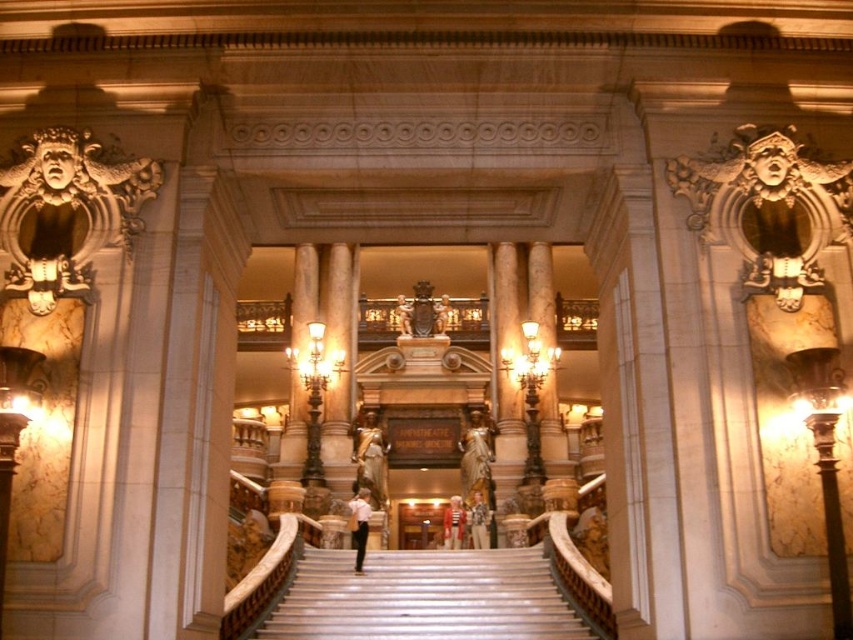
You are standing at the bottom of the staircase in the grand building. You see a light brown leather jacket at center. Can you estimate its location relative to the staircase?

The light brown leather jacket at center is located at point 0.816 along the x axis and 0.562 along the y axis, which is approximately 81.6 percent from the left edge and 56.2 percent from the bottom edge of the image.

You are standing at the bottom of the staircase and see the matte gold statue at center and the bronze statue at center. Which statue is closer to you?

The matte gold statue at center is closer to you because the bronze statue at center is behind it.

You are standing at the bottom of the white marble stairs at center and want to reach the person wearing the white matte shirt at center. Which direction should you move?

You should move upwards because the white marble stairs at center are located below the white matte shirt at center.